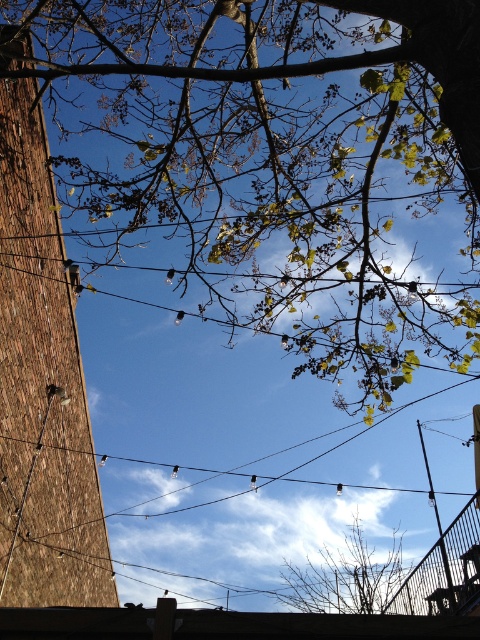
Question: Which is nearer to the bare branches at center?

Choices:
 (A) black metal fence at lower right
 (B) black wire at center

Answer: (B)

Question: Which point is farther to the camera?

Choices:
 (A) (348, 570)
 (B) (430, 577)
 (C) (308, 132)
 (D) (236, 472)

Answer: (A)

Question: Is bare branches at center to the left of black metal fence at lower right from the viewer's perspective?

Choices:
 (A) no
 (B) yes

Answer: (B)

Question: Does bare branches at center come in front of black metal fence at lower right?

Choices:
 (A) yes
 (B) no

Answer: (B)

Question: Which object is the closest to the black wire at center?

Choices:
 (A) green leafy tree at upper center
 (B) black metal fence at lower right

Answer: (B)

Question: From the image, what is the correct spatial relationship of bare branches at center in relation to black metal fence at lower right?

Choices:
 (A) right
 (B) left

Answer: (B)